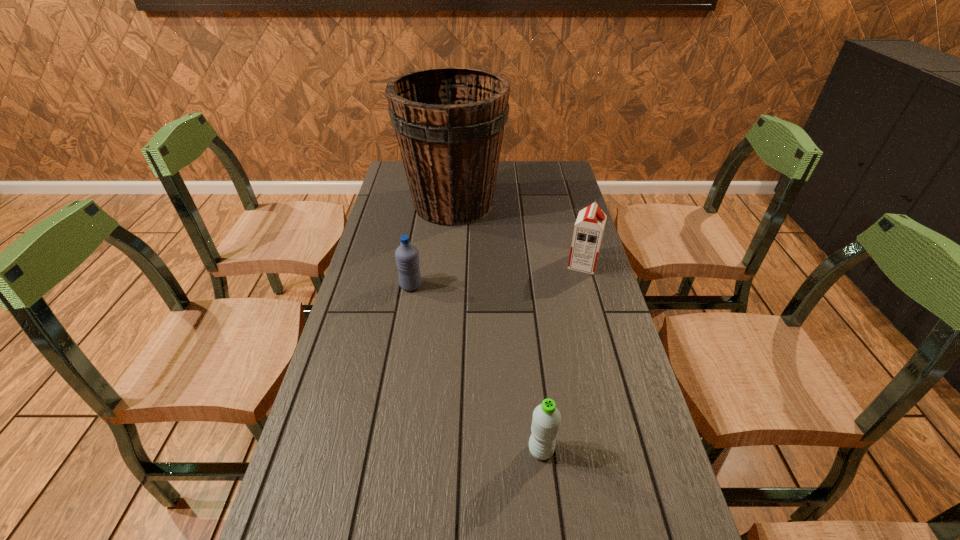
The height and width of the screenshot is (540, 960). What are the coordinates of `vacant space at the far right corner` in the screenshot? It's located at (547, 189).

The width and height of the screenshot is (960, 540). Find the location of `vacant space that's between the right water bottle and the third nearest object`. vacant space that's between the right water bottle and the third nearest object is located at coordinates (562, 357).

Where is `free space between the bucket and the third shortest object`? free space between the bucket and the third shortest object is located at coordinates (518, 234).

Where is `unoccupied area between the third shortest object and the tallest object`? unoccupied area between the third shortest object and the tallest object is located at coordinates (518, 234).

The height and width of the screenshot is (540, 960). In order to click on free spot between the rightmost object and the tallest object in this screenshot , I will do `click(518, 234)`.

The width and height of the screenshot is (960, 540). In order to click on free spot between the third farthest object and the soya milk in this screenshot , I will do `click(497, 275)`.

Where is `free space between the third farthest object and the rightmost object`? free space between the third farthest object and the rightmost object is located at coordinates (497, 275).

Where is `vacant region between the third shortest object and the tallest object`? vacant region between the third shortest object and the tallest object is located at coordinates (518, 234).

Where is `vacant area between the second tallest object and the second object from right to left`? vacant area between the second tallest object and the second object from right to left is located at coordinates (562, 357).

Find the location of a particular element. free area in between the rightmost object and the right water bottle is located at coordinates (562, 357).